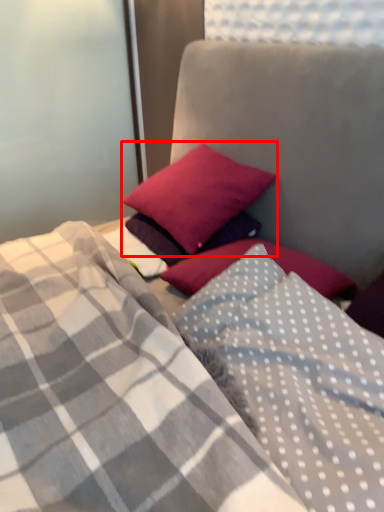
Question: Observing the image, what is the correct spatial positioning of pillow (annotated by the red box) in reference to pillow?

Choices:
 (A) right
 (B) left

Answer: (B)